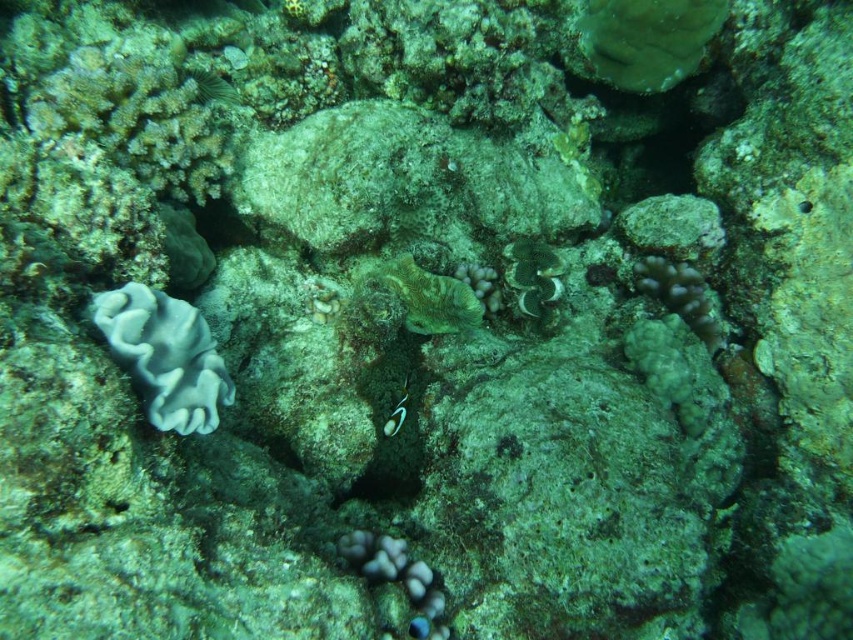
Consider the image. You are a marine biologist studying the coral reef. You notice a specific point in the image labeled as point (680, 296). What type of coral is located at this point?

The point (680, 296) corresponds to ruffled coral at center.

You are a scuba diver who needs to place a 30 inch long measuring tape between the white coral at left and the ruffled coral at center. Can the measuring tape fit between them without bending?

The distance between the white coral at left and the ruffled coral at center is 36.30 inches, which is longer than the 30 inch measuring tape. Therefore, the tape can fit between them without bending.

You are a scuba diver swimming towards the white coral at left and the green coral at center. Which coral will you encounter first?

You will encounter the white coral at left first because it is positioned in front of the green coral at center, making it closer to your current position.